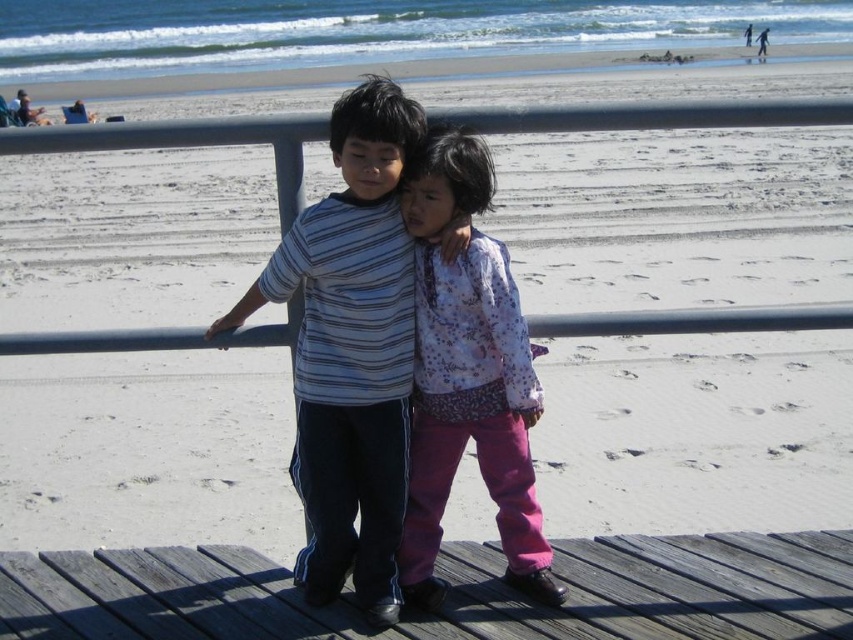
Question: Which of the following is the farthest from the observer?

Choices:
 (A) (416, 435)
 (B) (289, 259)
 (C) (202, 609)

Answer: (A)

Question: Estimate the real-world distances between objects in this image. Which object is farther from the wooden at center?

Choices:
 (A) floral fabric shirt at center
 (B) striped cotton shirt at center

Answer: (B)

Question: Is striped cotton shirt at center thinner than floral fabric shirt at center?

Choices:
 (A) yes
 (B) no

Answer: (B)

Question: Can you confirm if wooden at center is smaller than striped cotton shirt at center?

Choices:
 (A) no
 (B) yes

Answer: (B)

Question: Does wooden at center have a lesser width compared to floral fabric shirt at center?

Choices:
 (A) yes
 (B) no

Answer: (B)

Question: Estimate the real-world distances between objects in this image. Which object is closer to the wooden at center?

Choices:
 (A) floral fabric shirt at center
 (B) striped cotton shirt at center

Answer: (A)